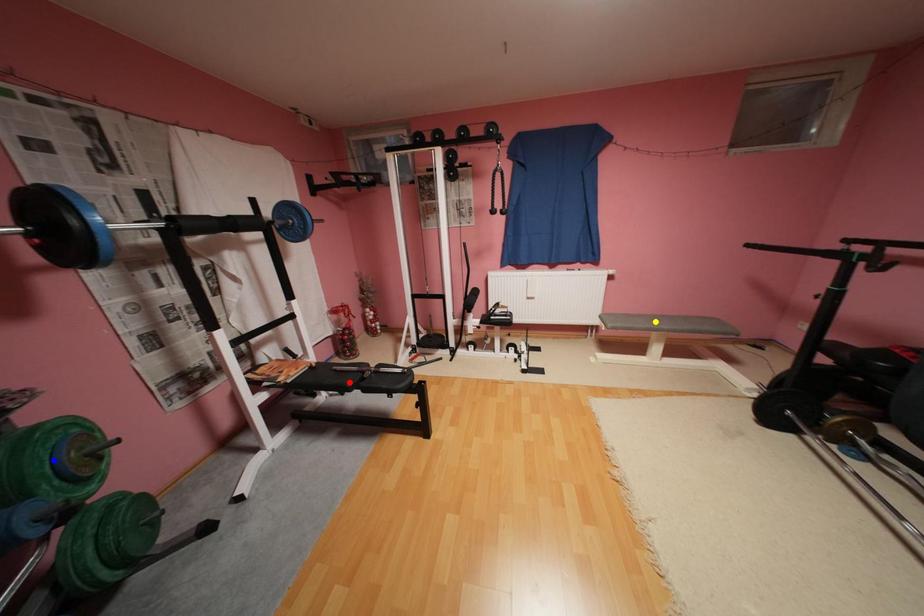
Order these from nearest to farthest:
1. blue point
2. red point
3. yellow point

yellow point → red point → blue point